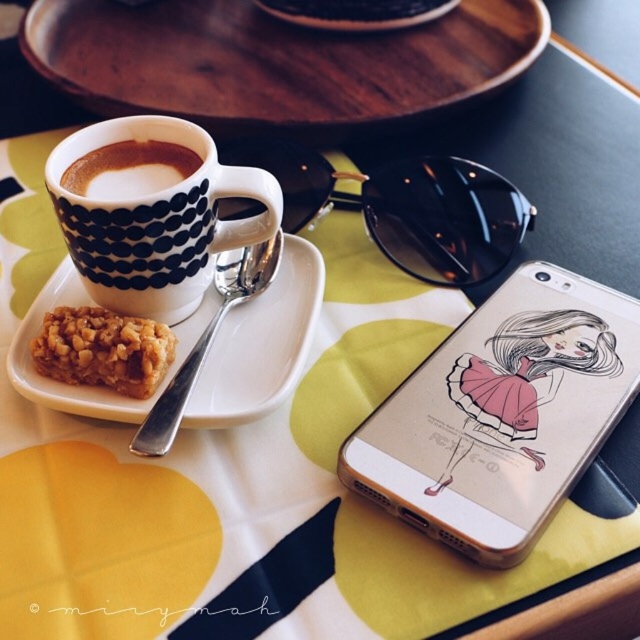
Based on the photo, is wooden tray at upper center positioned in front of white matte saucer at upper left?

That is False.

Who is taller, wooden tray at upper center or white matte saucer at upper left?

With more height is wooden tray at upper center.

Locate an element on the screen. The image size is (640, 640). wooden tray at upper center is located at coordinates (276, 61).

Is the position of wooden tray at upper center less distant than that of crispy golden bar at upper left?

That is False.

Who is more distant from viewer, [40,0] or [83,342]?

Positioned behind is point [40,0].

What are the coordinates of `wooden tray at upper center` in the screenshot? It's located at (276, 61).

Is transparent plastic phone case at upper right taller than brown matte cup at upper left?

Correct, transparent plastic phone case at upper right is much taller as brown matte cup at upper left.

Which is above, transparent plastic phone case at upper right or brown matte cup at upper left?

Positioned higher is brown matte cup at upper left.

Does point (445, 355) come closer to viewer compared to point (193, 150)?

Yes, it is.

This screenshot has height=640, width=640. I want to click on transparent plastic phone case at upper right, so click(x=500, y=413).